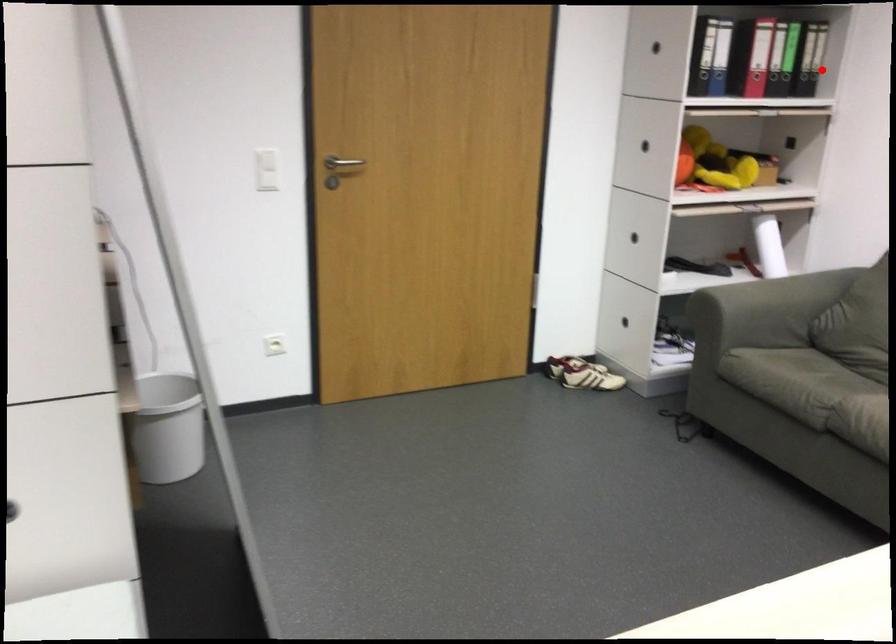
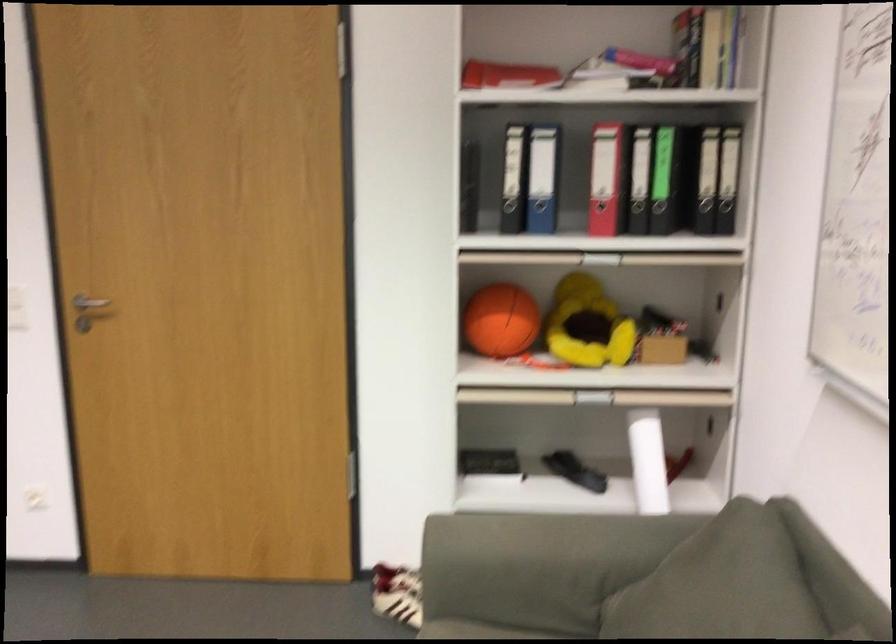
Locate, in the second image, the point that corresponds to the highlighted location in the first image.

(734, 214)